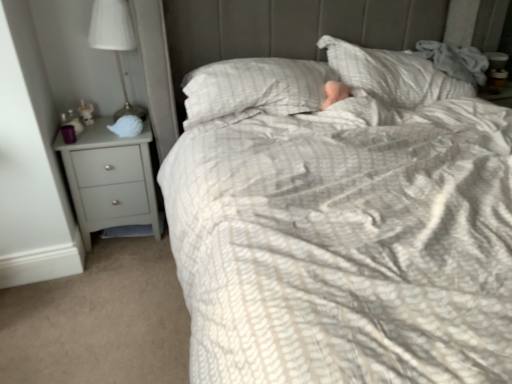
Question: Is white matte shell at left wider than matte gray chest of drawers at left?

Choices:
 (A) yes
 (B) no

Answer: (B)

Question: Are white matte shell at left and matte gray chest of drawers at left beside each other?

Choices:
 (A) no
 (B) yes

Answer: (A)

Question: From a real-world perspective, is white matte shell at left positioned over matte gray chest of drawers at left based on gravity?

Choices:
 (A) yes
 (B) no

Answer: (A)

Question: Would you say matte gray chest of drawers at left is part of white matte shell at left's contents?

Choices:
 (A) yes
 (B) no

Answer: (B)

Question: Is white matte shell at left behind matte gray chest of drawers at left?

Choices:
 (A) yes
 (B) no

Answer: (A)

Question: In terms of size, does white fabric lampshade at left appear bigger or smaller than matte gray chest of drawers at left?

Choices:
 (A) big
 (B) small

Answer: (B)

Question: Is point (95, 34) positioned closer to the camera than point (96, 137)?

Choices:
 (A) farther
 (B) closer

Answer: (B)

Question: Considering the positions of white fabric lampshade at left and matte gray chest of drawers at left in the image, is white fabric lampshade at left taller or shorter than matte gray chest of drawers at left?

Choices:
 (A) short
 (B) tall

Answer: (A)

Question: Is white fabric lampshade at left in front of or behind matte gray chest of drawers at left in the image?

Choices:
 (A) behind
 (B) front

Answer: (B)

Question: Is point (110, 44) closer or farther from the camera than point (118, 124)?

Choices:
 (A) closer
 (B) farther

Answer: (A)

Question: From a real-world perspective, relative to white matte shell at left, is white fabric lampshade at left vertically above or below?

Choices:
 (A) above
 (B) below

Answer: (A)

Question: In terms of size, does white fabric lampshade at left appear bigger or smaller than white matte shell at left?

Choices:
 (A) big
 (B) small

Answer: (A)

Question: In terms of width, does white fabric lampshade at left look wider or thinner when compared to white matte shell at left?

Choices:
 (A) thin
 (B) wide

Answer: (B)

Question: Which is correct: matte gray chest of drawers at left is inside white matte shell at left, or outside of it?

Choices:
 (A) outside
 (B) inside

Answer: (A)

Question: Considering the relative positions of matte gray chest of drawers at left and white matte shell at left in the image provided, is matte gray chest of drawers at left to the left or to the right of white matte shell at left?

Choices:
 (A) left
 (B) right

Answer: (A)